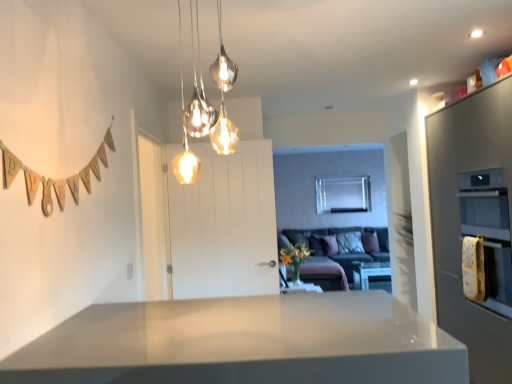
Question: Is metallic glass pendant lights at upper center shorter than white wooden door at center?

Choices:
 (A) no
 (B) yes

Answer: (B)

Question: Is metallic glass pendant lights at upper center further to the viewer compared to white wooden door at center?

Choices:
 (A) no
 (B) yes

Answer: (A)

Question: From a real-world perspective, is metallic glass pendant lights at upper center physically below white wooden door at center?

Choices:
 (A) yes
 (B) no

Answer: (B)

Question: Can you confirm if metallic glass pendant lights at upper center is positioned to the right of white wooden door at center?

Choices:
 (A) no
 (B) yes

Answer: (B)

Question: Is metallic glass pendant lights at upper center thinner than white wooden door at center?

Choices:
 (A) yes
 (B) no

Answer: (B)

Question: Is metallic glass pendant lights at upper center to the left of white wooden door at center from the viewer's perspective?

Choices:
 (A) yes
 (B) no

Answer: (B)

Question: Could you tell me if satin grey oven at right is facing white glossy table at center?

Choices:
 (A) no
 (B) yes

Answer: (A)

Question: Can we say satin grey oven at right lies outside white glossy table at center?

Choices:
 (A) no
 (B) yes

Answer: (B)

Question: From the image's perspective, is satin grey oven at right on top of white glossy table at center?

Choices:
 (A) yes
 (B) no

Answer: (A)

Question: Considering the relative positions of satin grey oven at right and white glossy table at center in the image provided, is satin grey oven at right to the left of white glossy table at center from the viewer's perspective?

Choices:
 (A) no
 (B) yes

Answer: (B)

Question: From the image's perspective, is satin grey oven at right under white glossy table at center?

Choices:
 (A) no
 (B) yes

Answer: (A)

Question: Can you confirm if satin grey oven at right is wider than white glossy table at center?

Choices:
 (A) yes
 (B) no

Answer: (A)

Question: Are velvet grey couch at center and satin grey oven at right making contact?

Choices:
 (A) yes
 (B) no

Answer: (B)